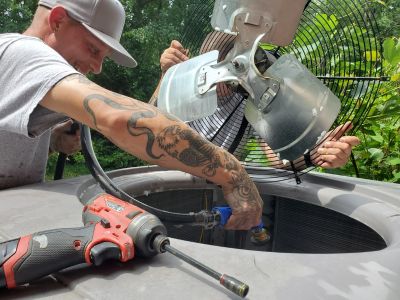
This screenshot has height=300, width=400. I want to click on fan grill, so click(x=296, y=107), click(x=177, y=79), click(x=268, y=10), click(x=337, y=44).